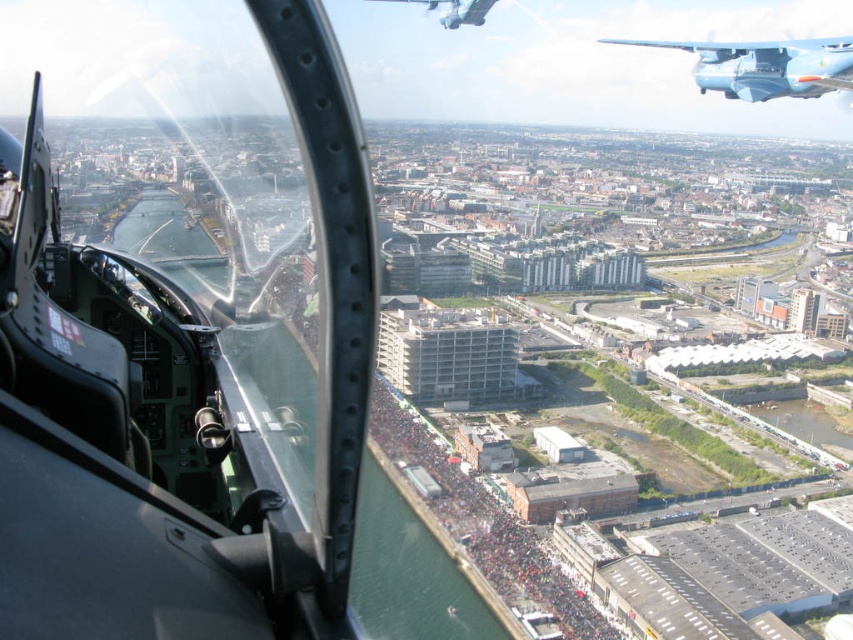
Question: Which of the following is the farthest from the observer?

Choices:
 (A) metallic blue airplane at upper right
 (B) blue metallic airplane at upper right

Answer: (A)

Question: Does blue metallic airplane at upper right appear under metallic blue airplane at upper right?

Choices:
 (A) yes
 (B) no

Answer: (A)

Question: Is blue metallic airplane at upper right bigger than metallic blue airplane at upper right?

Choices:
 (A) no
 (B) yes

Answer: (B)

Question: From the image, what is the correct spatial relationship of blue metallic airplane at upper right in relation to metallic blue airplane at upper right?

Choices:
 (A) above
 (B) below

Answer: (B)

Question: Which point appears farthest from the camera in this image?

Choices:
 (A) (712, 61)
 (B) (457, 20)

Answer: (B)